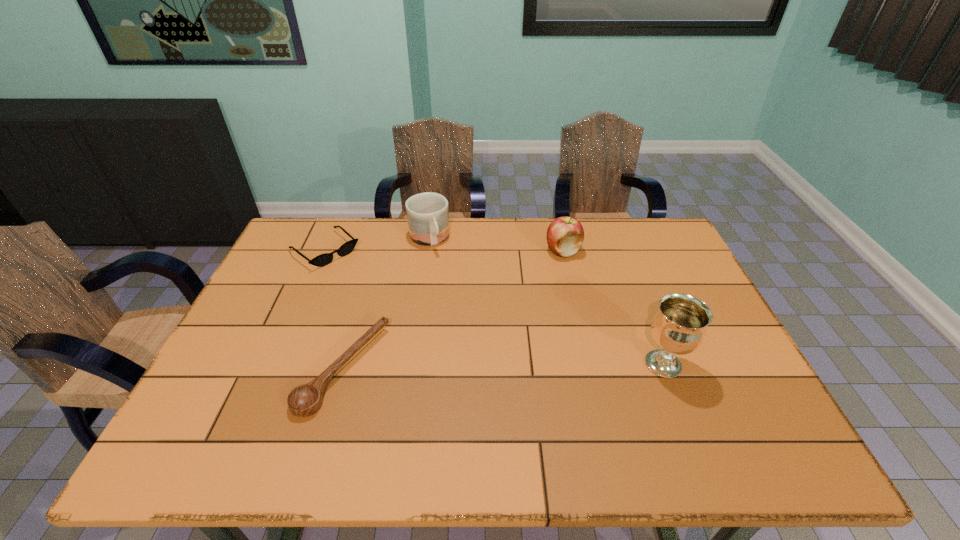
Where is `wooden spoon`? The width and height of the screenshot is (960, 540). wooden spoon is located at coordinates (304, 400).

Locate an element on the screen. The width and height of the screenshot is (960, 540). the rightmost object is located at coordinates (679, 326).

The width and height of the screenshot is (960, 540). Identify the location of chalice. (679, 326).

The image size is (960, 540). I want to click on mug, so click(x=427, y=213).

Locate an element on the screen. apple is located at coordinates (565, 235).

What are the coordinates of `sunglasses` in the screenshot? It's located at (324, 259).

At what (x,y) coordinates should I click in order to perform the action: click on blank space located on the left of the wooden spoon. Please return your answer as a coordinate pair (x, y). This screenshot has height=540, width=960. Looking at the image, I should click on (228, 368).

I want to click on vacant space located 0.140m on the right of the chalice, so click(x=742, y=364).

At what (x,y) coordinates should I click in order to perform the action: click on free space located 0.330m on the side with the handle of the mug. Please return your answer as a coordinate pair (x, y). The width and height of the screenshot is (960, 540). Looking at the image, I should click on (468, 326).

I want to click on vacant region located 0.300m on the side with the handle of the mug, so click(464, 318).